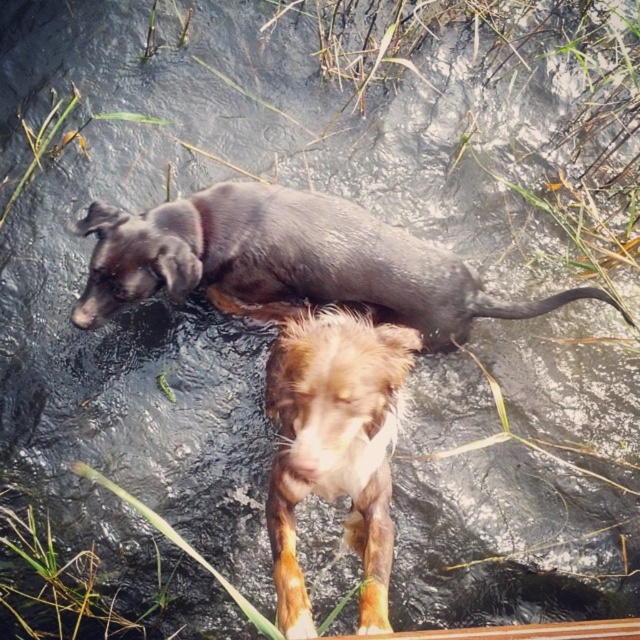
I want to click on shiny black dog at upper center, so click(x=289, y=262).

Does shiny black dog at upper center appear under brown furry dog at center?

Actually, shiny black dog at upper center is above brown furry dog at center.

Who is more distant from viewer, (x=252, y=266) or (x=292, y=372)?

Positioned behind is point (x=252, y=266).

Where is `shiny black dog at upper center`? shiny black dog at upper center is located at coordinates (289, 262).